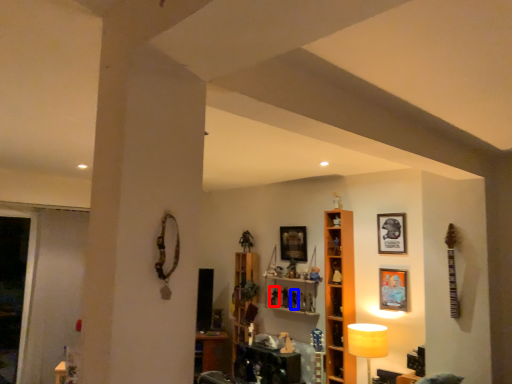
Question: Which point is closer to the camera, toy (highlighted by a red box) or toy (highlighted by a blue box)?

Choices:
 (A) toy
 (B) toy

Answer: (B)